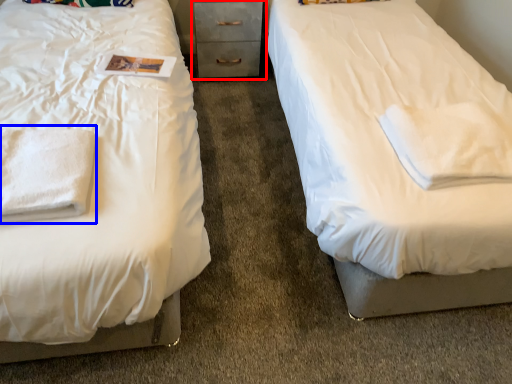
Question: Which object is further to the camera taking this photo, chest of drawers (highlighted by a red box) or cloth (highlighted by a blue box)?

Choices:
 (A) chest of drawers
 (B) cloth

Answer: (A)